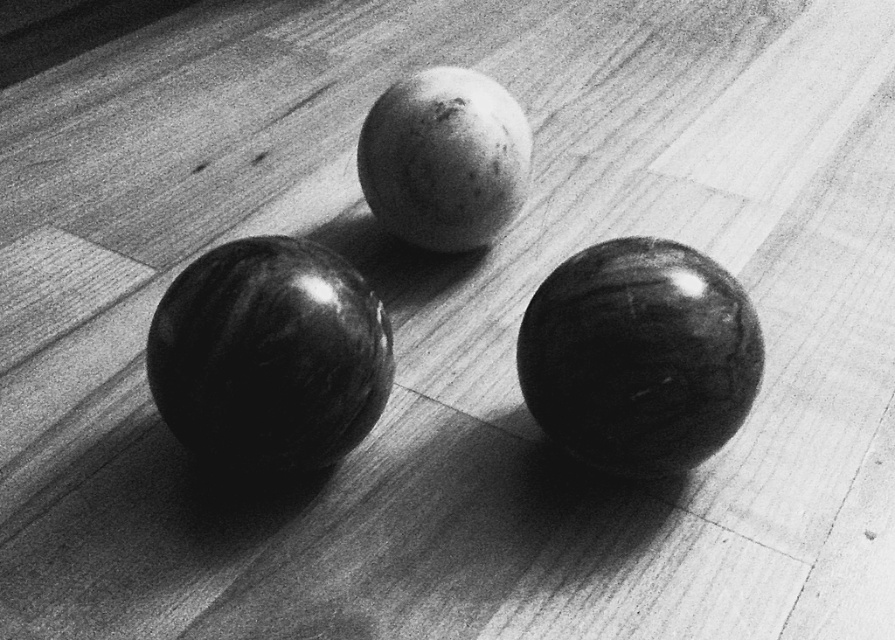
Can you confirm if glossy black bowling ball at lower right is thinner than matte white bowling ball at center?

In fact, glossy black bowling ball at lower right might be wider than matte white bowling ball at center.

Who is positioned more to the right, glossy black bowling ball at lower right or matte white bowling ball at center?

glossy black bowling ball at lower right

Which is behind, point (697, 444) or point (501, 212)?

The point (501, 212) is more distant.

Identify the location of glossy black bowling ball at lower right. This screenshot has height=640, width=895. (638, 355).

In the scene shown: Does shiny black bowling ball at center come behind glossy black bowling ball at lower right?

No, it is not.

Who is higher up, shiny black bowling ball at center or glossy black bowling ball at lower right?

shiny black bowling ball at center

Is point (205, 454) positioned behind point (655, 420)?

Yes.

You are a GUI agent. You are given a task and a screenshot of the screen. Output one action in this format:
    pyautogui.click(x=<x>, y=<y>)
    Task: Click on the shiny black bowling ball at center
    The height and width of the screenshot is (640, 895).
    Given the screenshot: What is the action you would take?
    pyautogui.click(x=269, y=356)

Who is more distant from viewer, (257, 337) or (427, 195)?

Point (427, 195)

Can you confirm if shiny black bowling ball at center is smaller than matte white bowling ball at center?

Correct, shiny black bowling ball at center occupies less space than matte white bowling ball at center.

The image size is (895, 640). In order to click on shiny black bowling ball at center in this screenshot , I will do `click(269, 356)`.